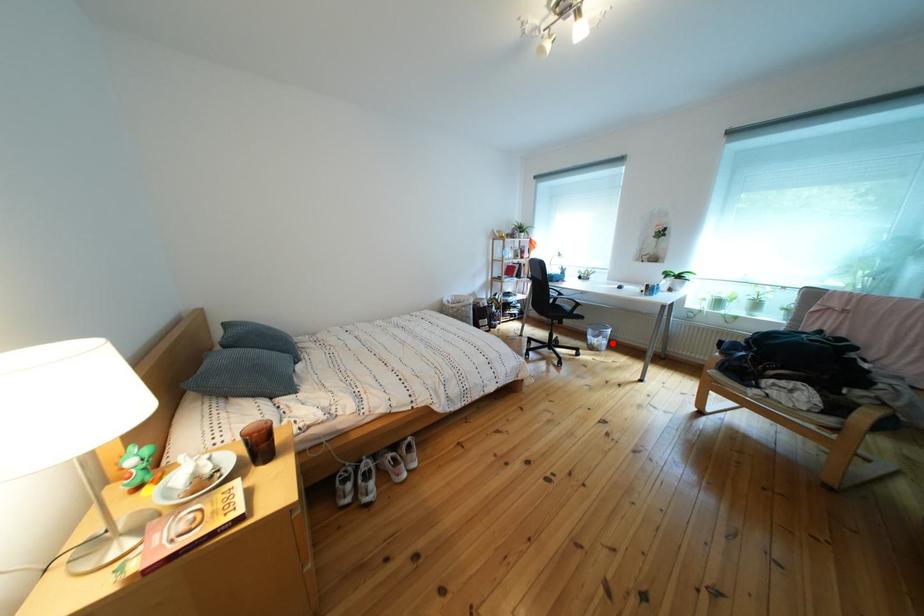
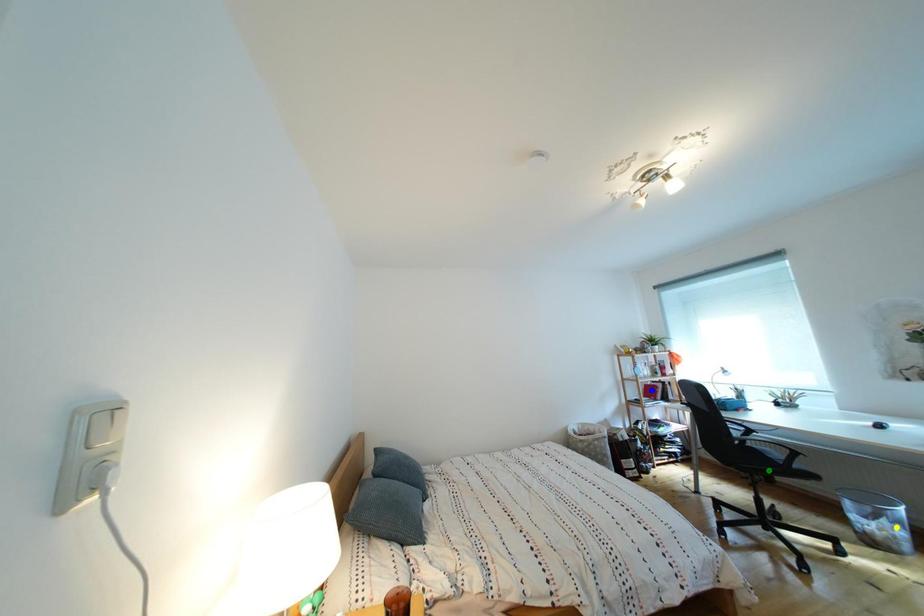
Question: I am providing you with two images of the same scene from different viewpoints. A red point is marked on the first image. You are given multiple points on the second image. Which point in image 2 is actually the same real-world point as the red point in image 1?

Choices:
 (A) yellow point
 (B) green point
 (C) blue point

Answer: (A)